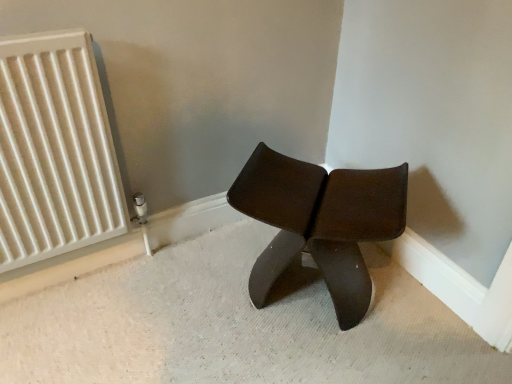
Locate an element on the screen. The image size is (512, 384). spots to the right of matte brown stool at center is located at coordinates [422, 314].